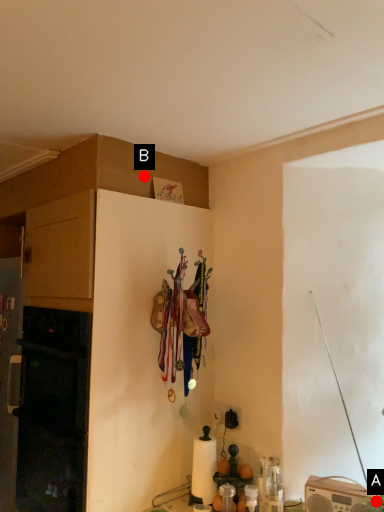
Question: Two points are circled on the image, labeled by A and B beside each circle. Which point is farther from the camera taking this photo?

Choices:
 (A) A is further
 (B) B is further

Answer: (B)